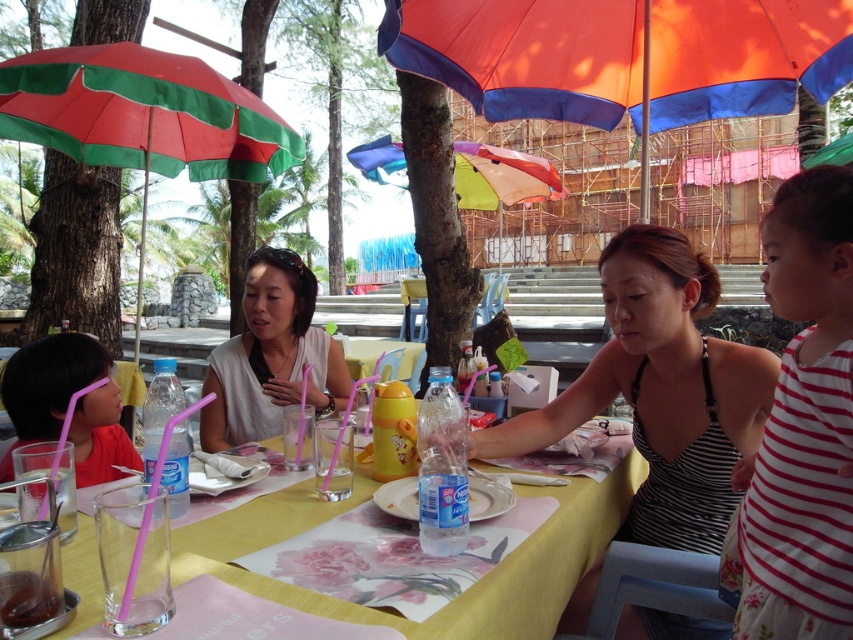
Is orange fabric umbrella at center wider than striped fabric dress at center?

Yes.

Does point (573, 122) lie behind point (552, 442)?

Yes, point (573, 122) is behind point (552, 442).

At what (x,y) coordinates should I click in order to perform the action: click on orange fabric umbrella at center. Please return your answer as a coordinate pair (x, y). This screenshot has height=640, width=853. Looking at the image, I should click on (624, 58).

Does point (184, 83) lie in front of point (175, 449)?

No, it is not.

Which is more to the left, green striped umbrella at left or clear plastic bottle at table center?

green striped umbrella at left is more to the left.

Identify the location of green striped umbrella at left. (143, 113).

Can you confirm if yellow fabric table at center is bigger than clear plastic bottle at table center?

Indeed, yellow fabric table at center has a larger size compared to clear plastic bottle at table center.

Who is more distant from viewer, (625,488) or (180,496)?

Point (625,488)

Describe the element at coordinates (453, 600) in the screenshot. I see `yellow fabric table at center` at that location.

The width and height of the screenshot is (853, 640). I want to click on yellow fabric table at center, so click(x=453, y=600).